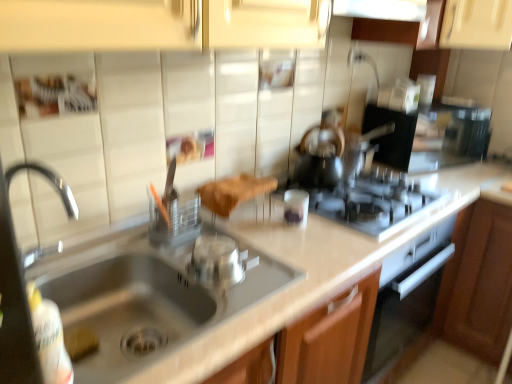
Question: Considering the positions of translucent glass tea pot at center and brown fabric at center in the image, is translucent glass tea pot at center taller or shorter than brown fabric at center?

Choices:
 (A) short
 (B) tall

Answer: (B)

Question: Is translucent glass tea pot at center bigger or smaller than brown fabric at center?

Choices:
 (A) small
 (B) big

Answer: (B)

Question: Considering the real-world distances, which object is closest to the brown wood cabinet at lower right?

Choices:
 (A) stainless steel sink at lower left
 (B) silver metallic pot at center, placed as the 1th appliance when sorted from front to back
 (C) transparent glass candle at center, which ranks as the second appliance in front-to-back order
 (D) black plastic coffee machine at upper right
 (E) satin silver gas stove at center

Answer: (E)

Question: Based on their relative distances, which object is nearer to the translucent glass tea pot at center?

Choices:
 (A) transparent glass candle at center, which is counted as the first appliance, starting from the right
 (B) stainless steel sink at lower left
 (C) brown fabric at center
 (D) beige laminate counter top at center
 (E) black plastic coffee machine at upper right

Answer: (A)